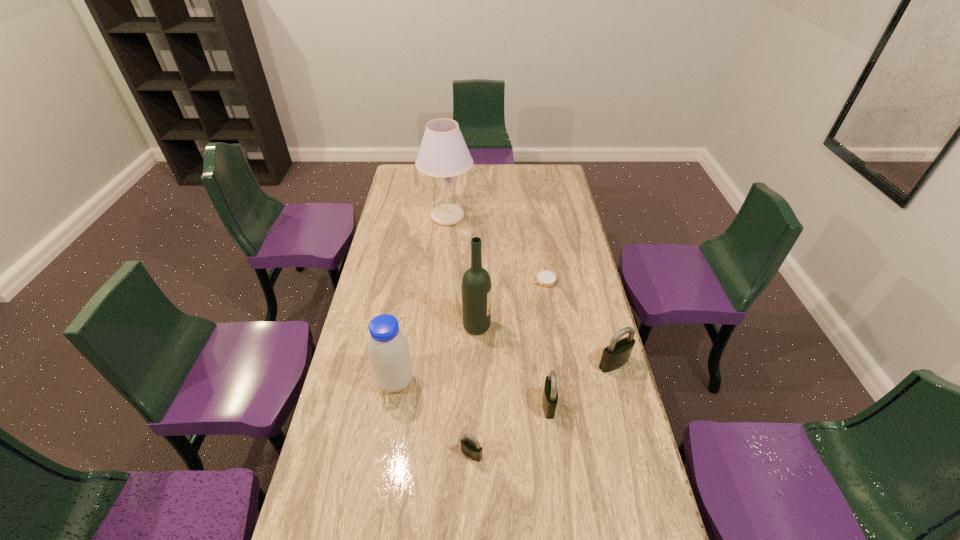
All padlocks are currently evenly spaced. To continue this pattern, where would you add another padlock on the left? Please point out a vacant spot. Please provide its 2D coordinates. Your answer should be formatted as a tuple, i.e. [(x, y)], where the tuple contains the x and y coordinates of a point satisfying the conditions above.

[(379, 512)]